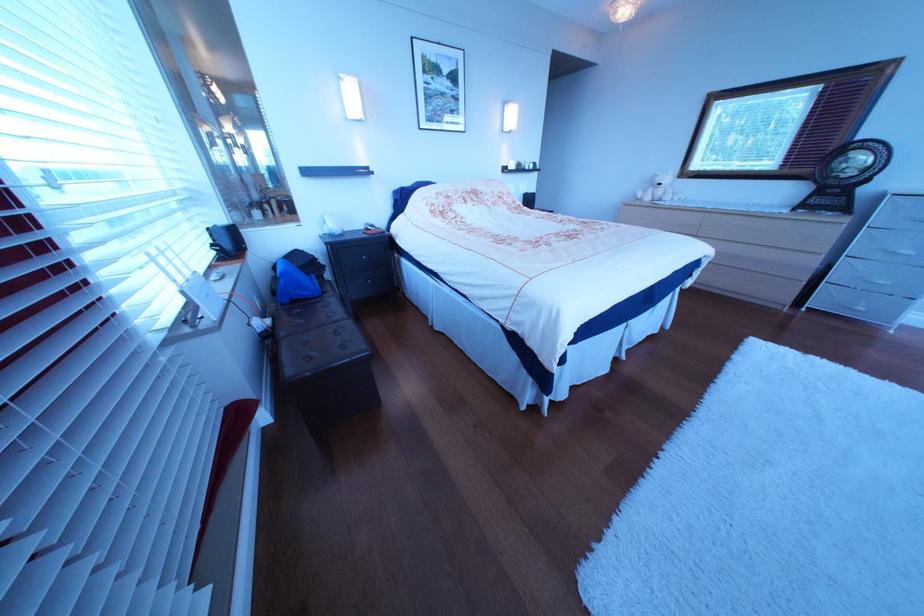
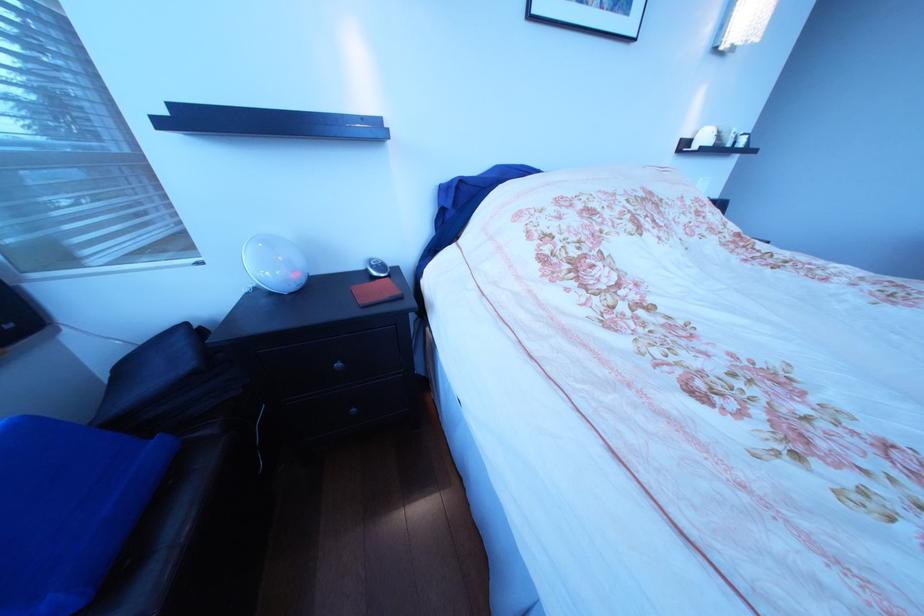
Question: Which direction would the cameraman need to move to produce the second image? Reply with the corresponding letter.

Choices:
 (A) Left
 (B) Right
 (C) Forward
 (D) Backward

Answer: (C)